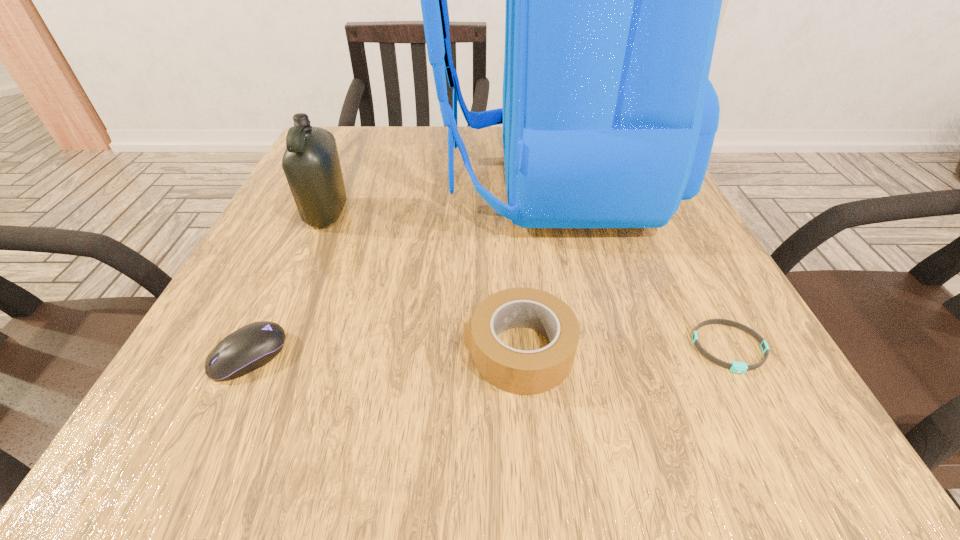
You are a GUI agent. You are given a task and a screenshot of the screen. Output one action in this format:
    pyautogui.click(x=<x>, y=<y>)
    Task: Click on the free space that satisfies the following two spatial constraints: 1. on the back side of the second tallest object; 2. on the right side of the computer mouse
    Image resolution: width=960 pixels, height=540 pixels.
    Given the screenshot: What is the action you would take?
    pyautogui.click(x=316, y=213)

The image size is (960, 540). What are the coordinates of `vacant position in the image that satisfies the following two spatial constraints: 1. on the back side of the second tallest object; 2. on the left side of the second shortest object` in the screenshot? It's located at (316, 213).

The width and height of the screenshot is (960, 540). In order to click on vacant space that satisfies the following two spatial constraints: 1. on the buckle of the wristband; 2. at the edge of the duct tape in this screenshot , I will do `click(731, 350)`.